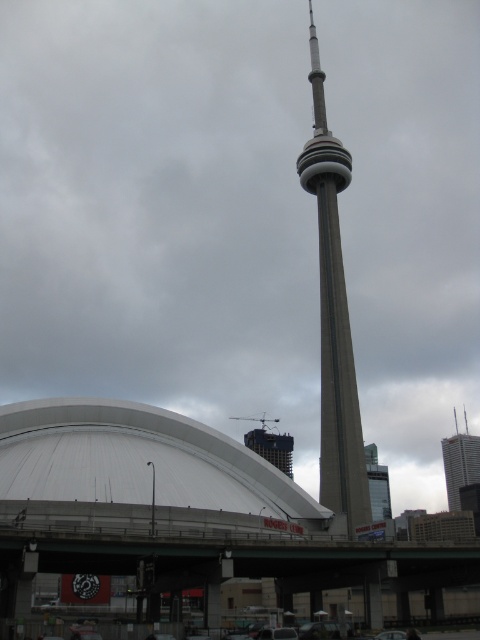
Question: Does concrete tower at center appear on the left side of gray concrete skyscraper at right?

Choices:
 (A) no
 (B) yes

Answer: (B)

Question: Does concrete tower at center have a larger size compared to gray concrete skyscraper at right?

Choices:
 (A) no
 (B) yes

Answer: (B)

Question: Which point is farther to the camera?

Choices:
 (A) gray concrete skyscraper at right
 (B) concrete tower at center

Answer: (A)

Question: Does concrete tower at center have a lesser width compared to gray concrete skyscraper at right?

Choices:
 (A) yes
 (B) no

Answer: (A)